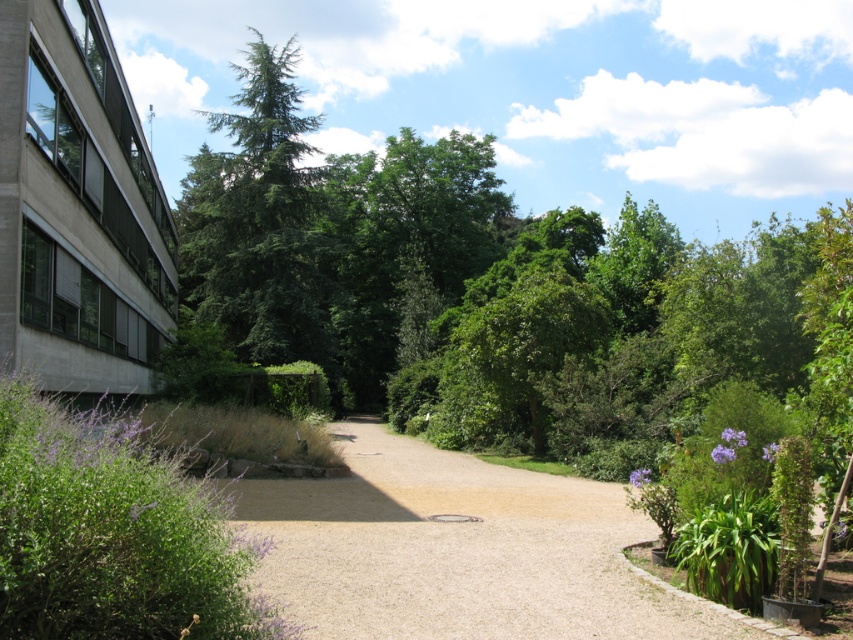
Question: From the image, what is the correct spatial relationship of light brown gravel driveway at center in relation to green needle-like tree at upper left?

Choices:
 (A) below
 (B) above

Answer: (A)

Question: Which of the following is the closest to the observer?

Choices:
 (A) (480, 492)
 (B) (263, 257)

Answer: (A)

Question: Does light brown gravel driveway at center appear over green needle-like tree at upper left?

Choices:
 (A) yes
 (B) no

Answer: (B)

Question: Can you confirm if light brown gravel driveway at center is smaller than green needle-like tree at upper left?

Choices:
 (A) yes
 (B) no

Answer: (A)